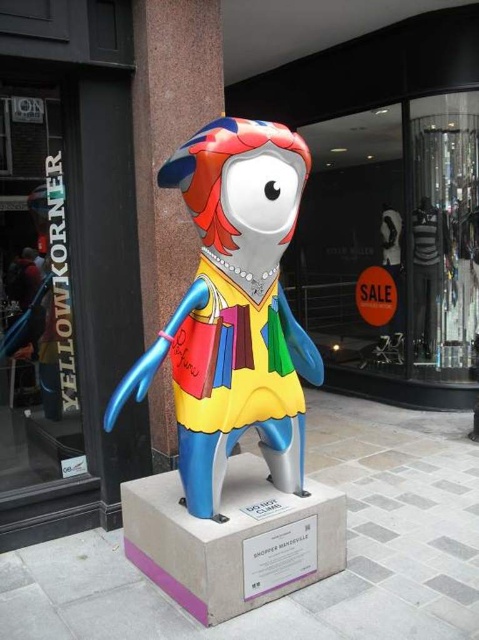
Question: Is glass display at center wider than transparent glass window at left?

Choices:
 (A) yes
 (B) no

Answer: (A)

Question: Based on their relative distances, which object is nearer to the transparent glass window at left?

Choices:
 (A) clear glass mannequins at center
 (B) glass display at center

Answer: (A)

Question: Based on their relative distances, which object is nearer to the transparent glass window at left?

Choices:
 (A) clear glass mannequins at center
 (B) metallic multicolored statue at center

Answer: (B)

Question: Can you confirm if glass display at center is bigger than metallic multicolored statue at center?

Choices:
 (A) yes
 (B) no

Answer: (A)

Question: Based on their relative distances, which object is farther from the glass display at center?

Choices:
 (A) clear glass mannequins at center
 (B) transparent glass window at left
 (C) metallic multicolored statue at center

Answer: (B)

Question: Can you confirm if glass display at center is positioned to the right of metallic multicolored statue at center?

Choices:
 (A) no
 (B) yes

Answer: (B)